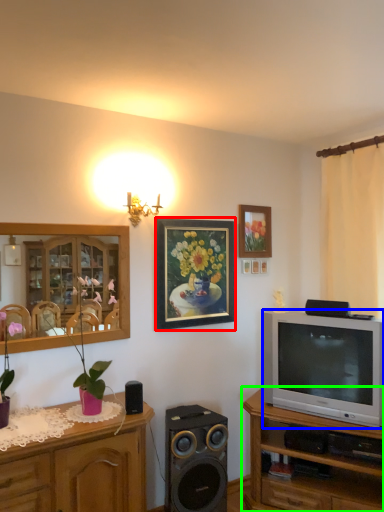
Question: Which object is positioned farthest from picture frame (highlighted by a red box)? Select from television (highlighted by a blue box) and cabinetry (highlighted by a green box).

Choices:
 (A) television
 (B) cabinetry

Answer: (B)